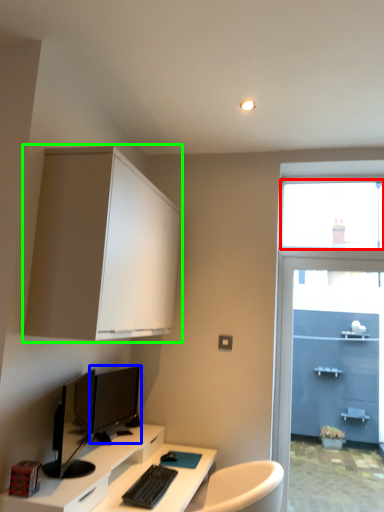
Question: Which object is positioned closest to window screen (highlighted by a red box)? Select from computer monitor (highlighted by a blue box) and cabinetry (highlighted by a green box).

Choices:
 (A) computer monitor
 (B) cabinetry

Answer: (B)